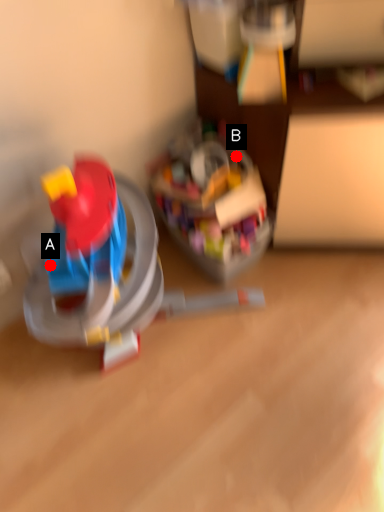
Question: Two points are circled on the image, labeled by A and B beside each circle. Among these points, which one is farthest from the camera?

Choices:
 (A) A is further
 (B) B is further

Answer: (B)